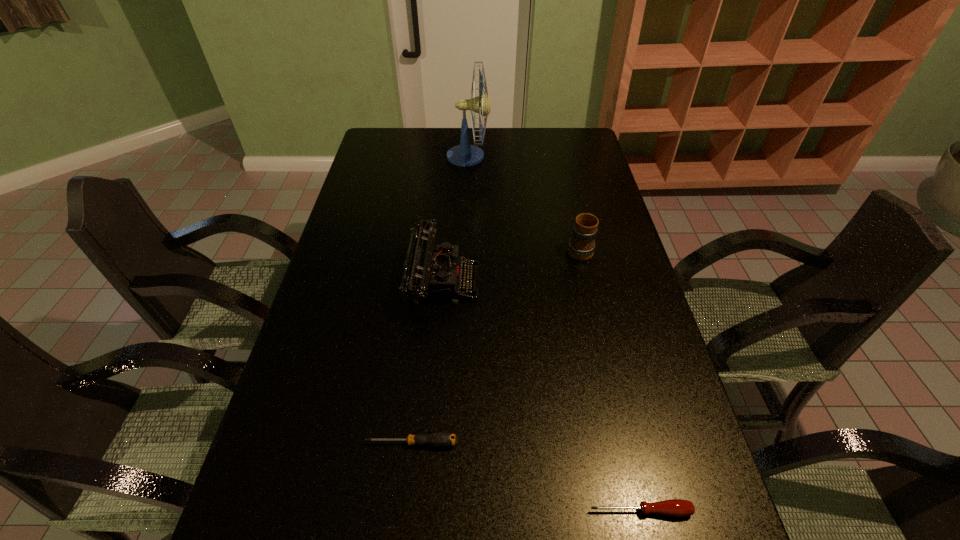
This screenshot has width=960, height=540. In the image, there is a desktop. Identify the location of vacant space at the right edge. (567, 183).

In the image, there is a desktop. What are the coordinates of `vacant space at the far right corner` in the screenshot? It's located at (578, 136).

At what (x,y) coordinates should I click in order to perform the action: click on free space that is in between the right screwdriver and the typewriter. Please return your answer as a coordinate pair (x, y). The height and width of the screenshot is (540, 960). Looking at the image, I should click on (541, 396).

What are the coordinates of `free spot between the mug and the typewriter` in the screenshot? It's located at (511, 265).

At what (x,y) coordinates should I click in order to perform the action: click on free spot between the typewriter and the mug. Please return your answer as a coordinate pair (x, y). This screenshot has height=540, width=960. Looking at the image, I should click on (511, 265).

Find the location of `vacant space that's between the farther screwdriver and the typewriter`. vacant space that's between the farther screwdriver and the typewriter is located at coordinates (427, 362).

Find the location of a particular element. The width and height of the screenshot is (960, 540). empty space between the mug and the right screwdriver is located at coordinates (610, 380).

Where is `vacant space that is in between the fourth farthest object and the typewriter`? vacant space that is in between the fourth farthest object and the typewriter is located at coordinates (427, 362).

Find the location of `free space between the typewriter and the mug`. free space between the typewriter and the mug is located at coordinates (511, 265).

You are a GUI agent. You are given a task and a screenshot of the screen. Output one action in this format:
    pyautogui.click(x=<x>, y=<y>)
    Task: Click on the empty space that is in between the fan and the typewriter
    
    Given the screenshot: What is the action you would take?
    pyautogui.click(x=455, y=219)